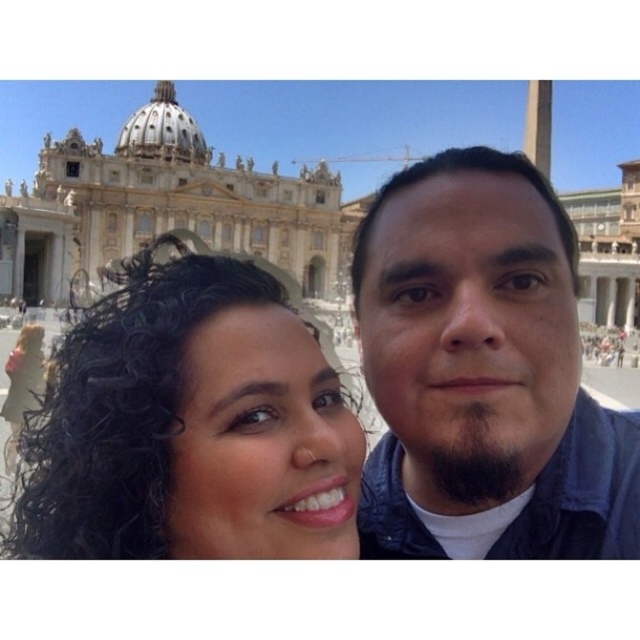
You are a photographer trying to capture a group photo of the two people in the image. Given that the dark blue jacket at center and the dark curly hair at center are in the frame, which object is positioned higher in the image?

The dark blue jacket at center is much taller than the dark curly hair at center, so it is positioned higher in the image.

From the picture: You are standing in front of the grand architectural structure and see both the matte blue jacket at center and the dark blue jacket at center. Which one is positioned to the left?

The matte blue jacket at center is to the left of the dark blue jacket at center.

You are a photographer trying to capture a clear shot of both the matte blue jacket at center and the dark curly hair at center. Given their positions and sizes, which object will appear taller in the photo?

The matte blue jacket at center appears taller in the photo because it has a greater height compared to the dark curly hair at center.